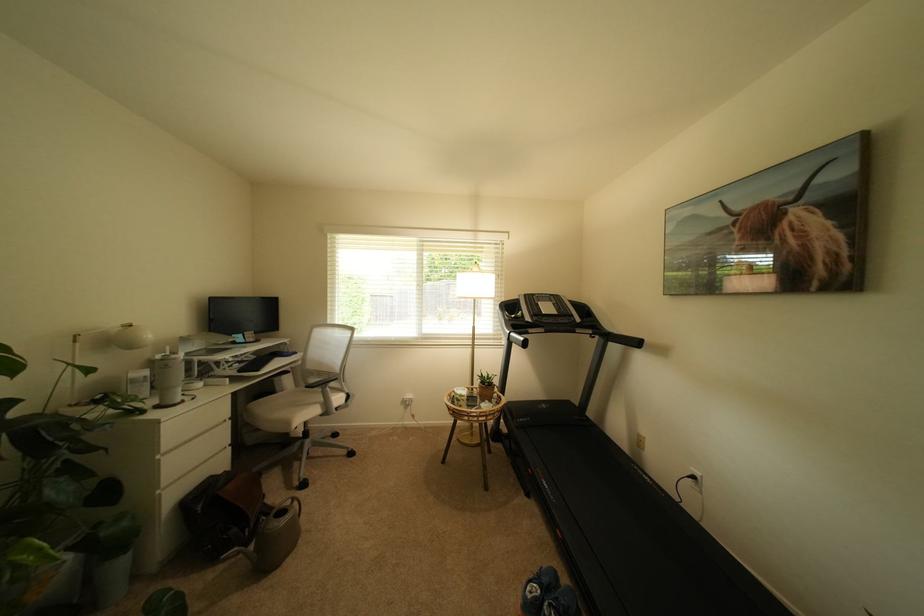
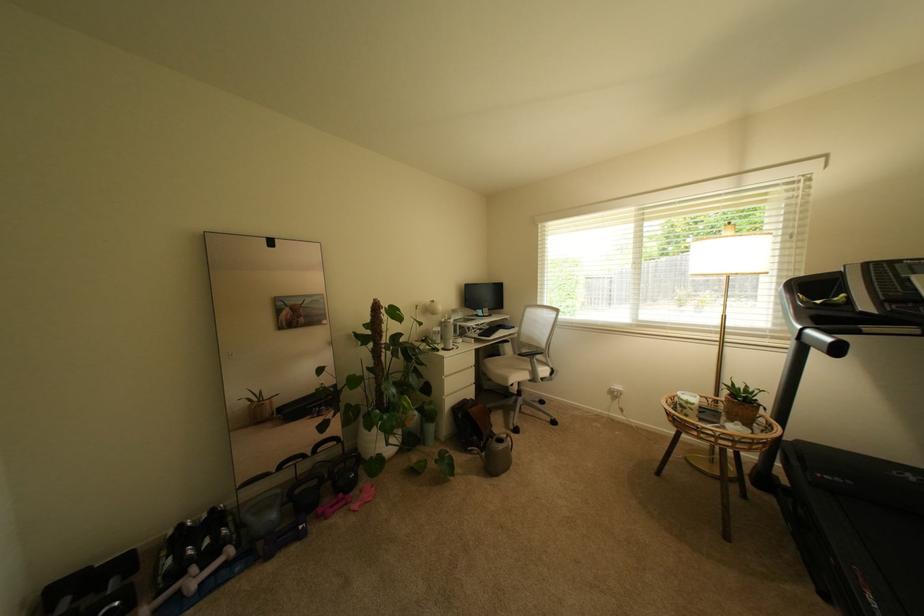
Find the pixel in the second image that matches point (331, 400) in the first image.

(540, 370)